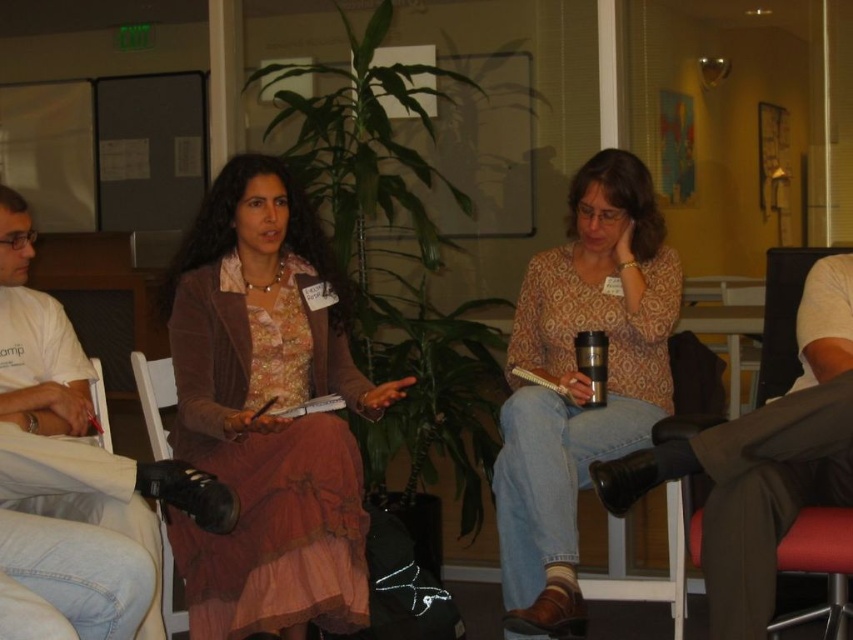
Question: Is matte pink dress at center wider than patterned fabric blouse at center?

Choices:
 (A) yes
 (B) no

Answer: (A)

Question: Which of the following is the farthest from the observer?

Choices:
 (A) patterned fabric blouse at center
 (B) matte pink dress at center

Answer: (A)

Question: Which object is the closest to the patterned fabric blouse at center?

Choices:
 (A) matte pink dress at center
 (B) brown leather chair at lower right

Answer: (B)

Question: Is patterned fabric blouse at center above brown leather chair at lower right?

Choices:
 (A) yes
 (B) no

Answer: (A)

Question: Among these objects, which one is farthest from the camera?

Choices:
 (A) silver metallic cup at center
 (B) patterned fabric blouse at center

Answer: (A)

Question: Is patterned fabric blouse at center smaller than brown leather chair at lower right?

Choices:
 (A) yes
 (B) no

Answer: (B)